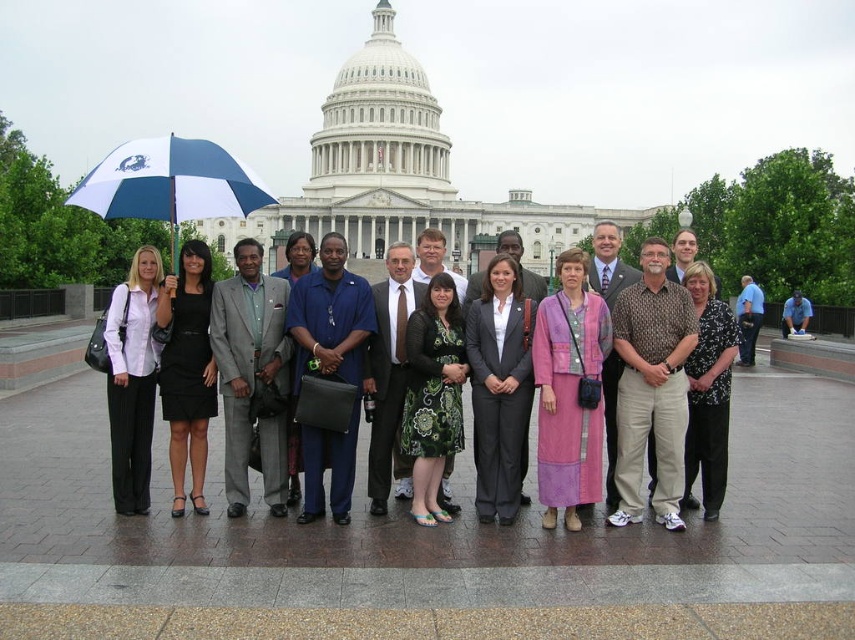
Question: Among these points, which one is farthest from the camera?

Choices:
 (A) (797, 321)
 (B) (144, 406)

Answer: (A)

Question: Which object appears farthest from the camera in this image?

Choices:
 (A) blue shirt at center
 (B) blue fabric shirt at center

Answer: (A)

Question: Is blue and white fabric umbrella at center in front of matte black suit at center?

Choices:
 (A) no
 (B) yes

Answer: (A)

Question: Does blue fabric shirt at center appear on the right side of matte black suit at center?

Choices:
 (A) no
 (B) yes

Answer: (A)

Question: Does black fabric dress at center have a lesser width compared to blue shirt at center?

Choices:
 (A) no
 (B) yes

Answer: (A)

Question: Which point is farther to the camera?

Choices:
 (A) matte gray suit at center
 (B) light blue shirt at center
 (C) black floral blouse at center
 (D) blue fabric shirt at center

Answer: (B)